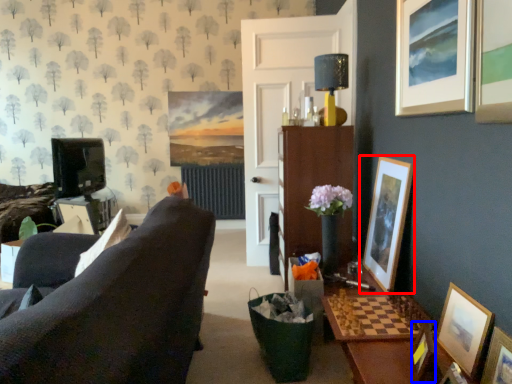
Question: Among these objects, which one is nearest to the camera, picture frame (highlighted by a red box) or picture frame (highlighted by a blue box)?

Choices:
 (A) picture frame
 (B) picture frame

Answer: (B)